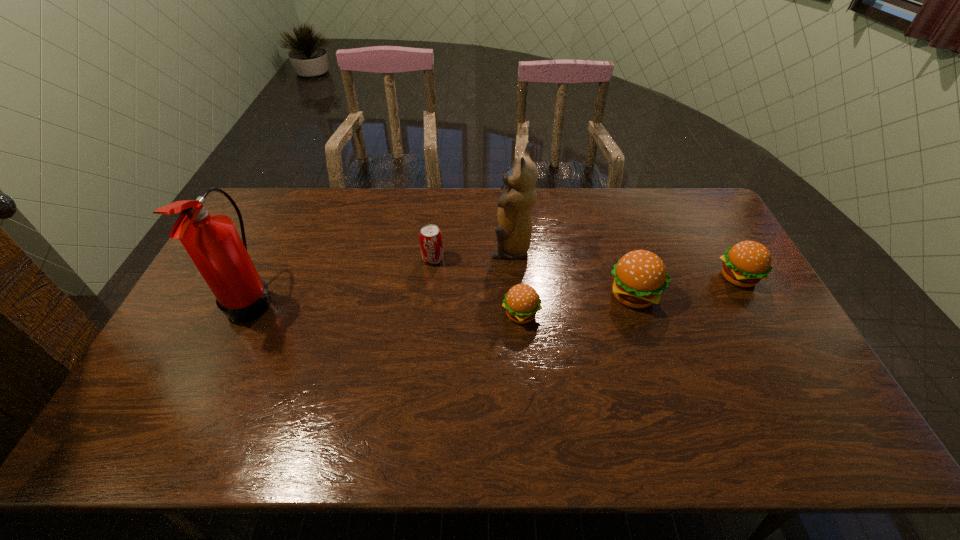
The hamburgers are evenly distributed in the image. To maintain this, where would you place another hamburger on the left? Please point to a free space. Please provide its 2D coordinates. Your answer should be formatted as a tuple, i.e. [(x, y)], where the tuple contains the x and y coordinates of a point satisfying the conditions above.

[(399, 336)]